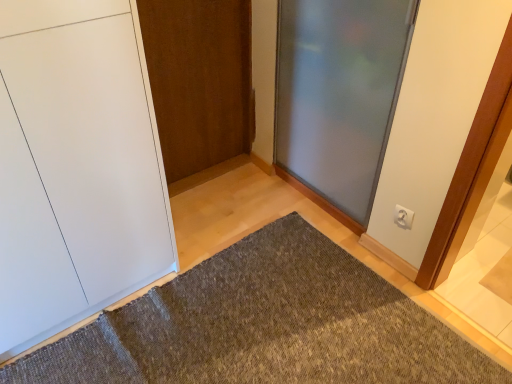
Question: Can you confirm if frosted glass door at center, which is the 1th door in right-to-left order, is smaller than white plastic electric outlet at upper right?

Choices:
 (A) yes
 (B) no

Answer: (B)

Question: Could you tell me if frosted glass door at center, which appears as the 3th door when viewed from the left, is turned towards white plastic electric outlet at upper right?

Choices:
 (A) yes
 (B) no

Answer: (B)

Question: Considering the relative sizes of frosted glass door at center, which is the 1th door in right-to-left order, and white plastic electric outlet at upper right in the image provided, is frosted glass door at center, which is the 1th door in right-to-left order, taller than white plastic electric outlet at upper right?

Choices:
 (A) yes
 (B) no

Answer: (A)

Question: From a real-world perspective, is frosted glass door at center, which is the 1th door in right-to-left order, on top of white plastic electric outlet at upper right?

Choices:
 (A) no
 (B) yes

Answer: (B)

Question: Are frosted glass door at center, which is the 1th door in right-to-left order, and white plastic electric outlet at upper right making contact?

Choices:
 (A) no
 (B) yes

Answer: (A)

Question: From their relative heights in the image, would you say frosted glass door at center, which appears as the 3th door when viewed from the left, is taller or shorter than white matte door at left, which is the first door in left-to-right order?

Choices:
 (A) short
 (B) tall

Answer: (A)

Question: Considering their positions, is frosted glass door at center, which appears as the 3th door when viewed from the left, located in front of or behind white matte door at left, which is the first door in left-to-right order?

Choices:
 (A) front
 (B) behind

Answer: (B)

Question: From a real-world perspective, is frosted glass door at center, which appears as the 3th door when viewed from the left, physically located above or below white matte door at left, which is the first door in left-to-right order?

Choices:
 (A) below
 (B) above

Answer: (A)

Question: Looking at their shapes, would you say frosted glass door at center, which appears as the 3th door when viewed from the left, is wider or thinner than white matte door at left, which appears as the 3th door when viewed from the right?

Choices:
 (A) thin
 (B) wide

Answer: (A)

Question: From the image's perspective, is white matte door at left, which appears as the 3th door when viewed from the right, positioned above or below wooden door at center, which appears as the second door when viewed from the left?

Choices:
 (A) above
 (B) below

Answer: (B)

Question: Is point (51, 314) closer or farther from the camera than point (157, 66)?

Choices:
 (A) closer
 (B) farther

Answer: (A)

Question: In the image, is white matte door at left, which is the first door in left-to-right order, positioned in front of or behind wooden door at center, which is counted as the 2th door, starting from the right?

Choices:
 (A) behind
 (B) front

Answer: (B)

Question: From their relative heights in the image, would you say white matte door at left, which is the first door in left-to-right order, is taller or shorter than wooden door at center, which appears as the second door when viewed from the left?

Choices:
 (A) tall
 (B) short

Answer: (A)

Question: Is white plastic electric outlet at upper right inside or outside of textured gray doormat at center?

Choices:
 (A) inside
 (B) outside

Answer: (B)

Question: From a real-world perspective, is white plastic electric outlet at upper right physically located above or below textured gray doormat at center?

Choices:
 (A) below
 (B) above

Answer: (B)